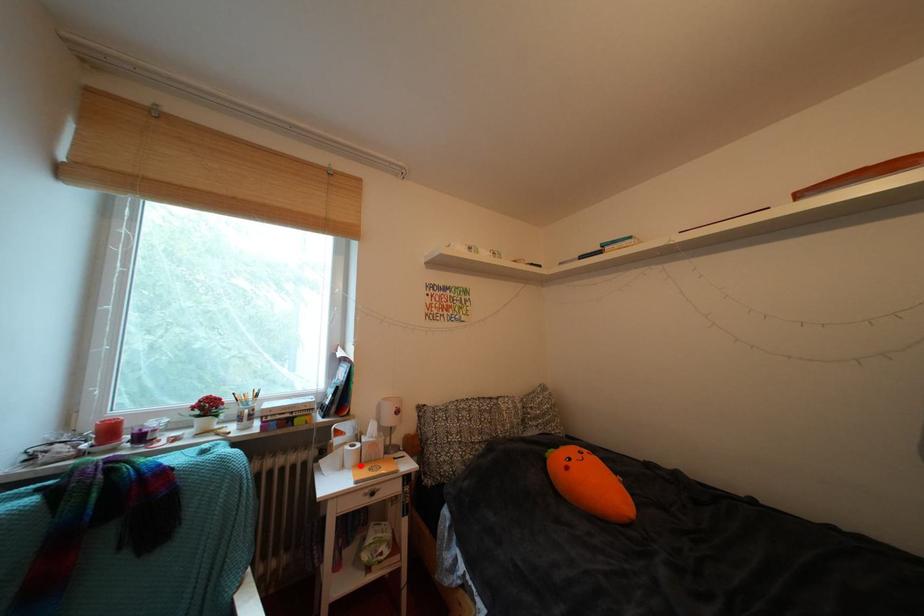
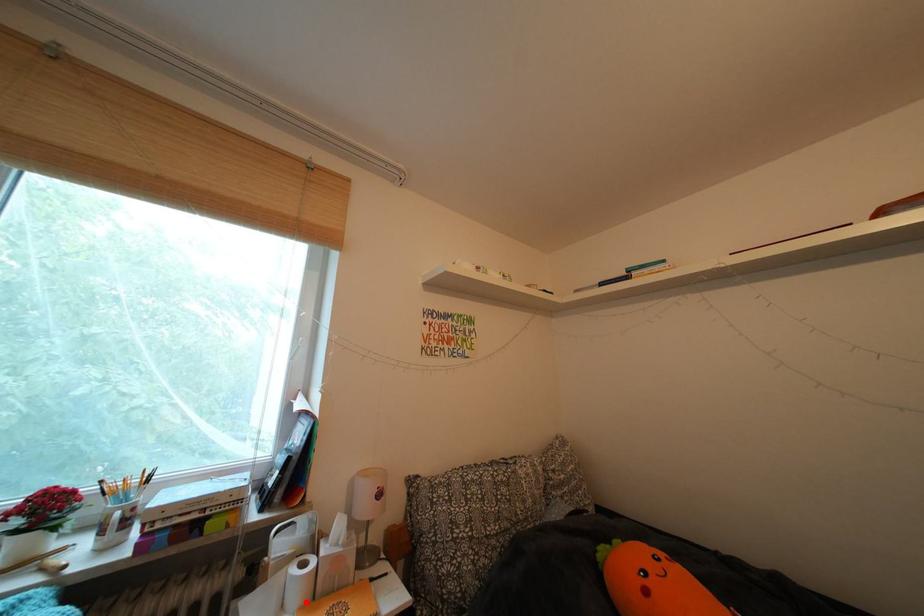
From the picture: I am providing you with two images of the same scene from different viewpoints. A red point is marked on the first image and another point is marked on the second image. Is the red point in image1 aligned with the point shown in image2?

Yes